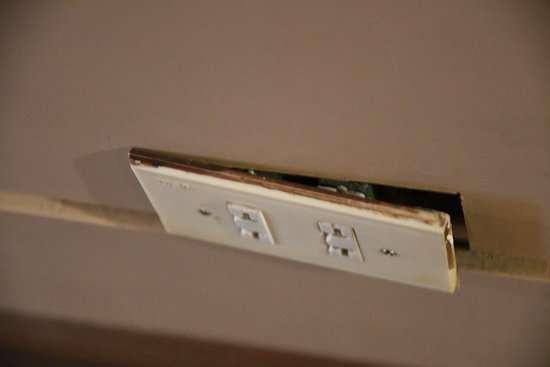
The height and width of the screenshot is (367, 550). Find the location of `floor`. floor is located at coordinates (129, 334).